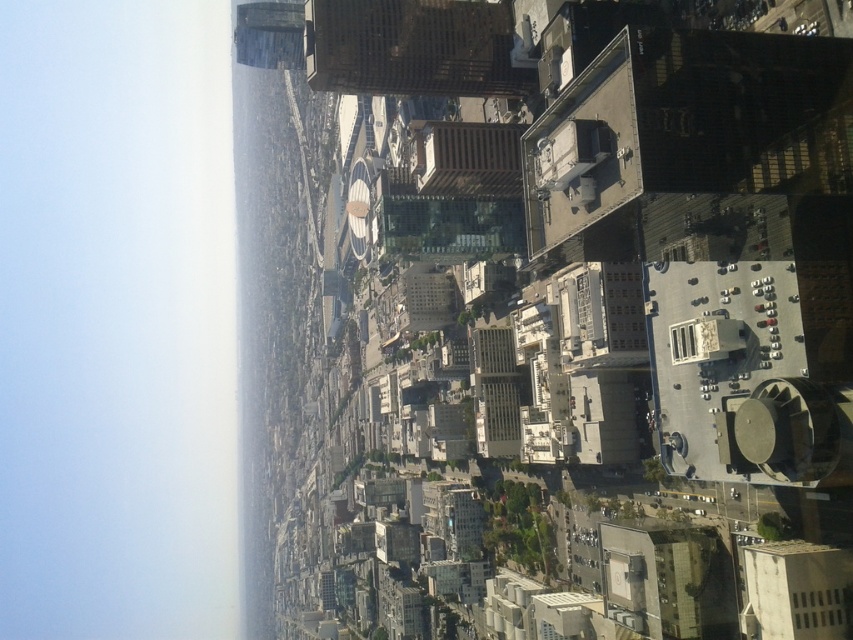
Question: Is transparent glass window at lower right bigger than transparent glass window at upper right?

Choices:
 (A) no
 (B) yes

Answer: (B)

Question: Which point is farther from the camera taking this photo?

Choices:
 (A) (695, 348)
 (B) (839, 593)

Answer: (A)

Question: Is transparent glass window at lower right positioned in front of transparent glass window at upper right?

Choices:
 (A) no
 (B) yes

Answer: (B)

Question: Considering the relative positions of transparent glass window at lower right and transparent glass window at upper right in the image provided, where is transparent glass window at lower right located with respect to transparent glass window at upper right?

Choices:
 (A) right
 (B) left

Answer: (A)